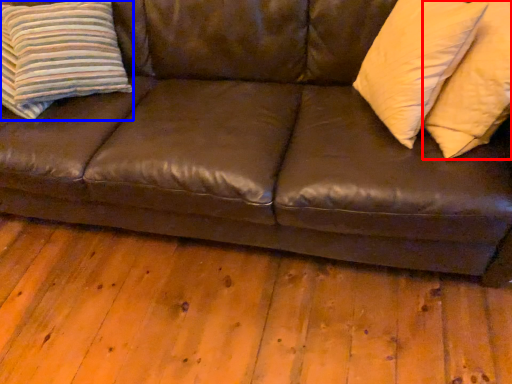
Question: Which point is closer to the camera, pillow (highlighted by a red box) or pillow (highlighted by a blue box)?

Choices:
 (A) pillow
 (B) pillow

Answer: (A)